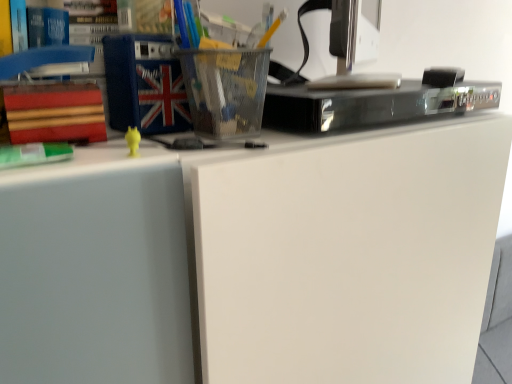
The width and height of the screenshot is (512, 384). What are the coordinates of `black glossy dvd player at upper center` in the screenshot? It's located at 370,105.

Considering the sizes of objects black glossy dvd player at upper center and blue fabric book at upper left, placed as the 1th paperback book when sorted from right to left, in the image provided, who is bigger, black glossy dvd player at upper center or blue fabric book at upper left, placed as the 1th paperback book when sorted from right to left,?

black glossy dvd player at upper center is bigger.

How distant is black glossy dvd player at upper center from blue fabric book at upper left, placed as the 1th paperback book when sorted from right to left?

The distance of black glossy dvd player at upper center from blue fabric book at upper left, placed as the 1th paperback book when sorted from right to left, is 9.65 inches.

From a real-world perspective, between black glossy dvd player at upper center and blue fabric book at upper left, placed as the 1th paperback book when sorted from right to left, who is vertically higher?

blue fabric book at upper left, placed as the 1th paperback book when sorted from right to left, is physically above.

Is black glossy dvd player at upper center looking in the opposite direction of blue fabric book at upper left, which is the second paperback book in bottom-to-top order?

No, black glossy dvd player at upper center is not facing the opposite direction of blue fabric book at upper left, which is the second paperback book in bottom-to-top order.

Which of these two, black glossy dvd player at upper center or metallic silver desktop computer at upper right, is thinner?

With smaller width is metallic silver desktop computer at upper right.

From a real-world perspective, who is located higher, black glossy dvd player at upper center or metallic silver desktop computer at upper right?

metallic silver desktop computer at upper right, from a real-world perspective.

Can metallic silver desktop computer at upper right be found inside black glossy dvd player at upper center?

No.

From the picture: Can you confirm if black glossy dvd player at upper center is shorter than metallic silver desktop computer at upper right?

Correct, black glossy dvd player at upper center is not as tall as metallic silver desktop computer at upper right.

What's the angular difference between blue fabric book at upper left, placed as the 1th paperback book when sorted from right to left, and green matte book at left's facing directions?

0.629 degrees.

Between blue fabric book at upper left, acting as the first paperback book starting from the top, and green matte book at left, which one has larger size?

Bigger between the two is blue fabric book at upper left, acting as the first paperback book starting from the top.

Considering the relative sizes of blue fabric book at upper left, placed as the 1th paperback book when sorted from right to left, and green matte book at left in the image provided, is blue fabric book at upper left, placed as the 1th paperback book when sorted from right to left, thinner than green matte book at left?

No, blue fabric book at upper left, placed as the 1th paperback book when sorted from right to left, is not thinner than green matte book at left.

Relative to green matte book at left, is blue fabric book at upper left, the 2th paperback book when ordered from left to right, in front or behind?

Clearly, blue fabric book at upper left, the 2th paperback book when ordered from left to right, is behind green matte book at left.

Which object is positioned more to the left, red matte book at left, positioned as the 2th paperback book in top-to-bottom order, or black glossy dvd player at upper center?

From the viewer's perspective, red matte book at left, positioned as the 2th paperback book in top-to-bottom order, appears more on the left side.

Consider the image. Considering the relative sizes of red matte book at left, positioned as the 2th paperback book in top-to-bottom order, and black glossy dvd player at upper center in the image provided, is red matte book at left, positioned as the 2th paperback book in top-to-bottom order, shorter than black glossy dvd player at upper center?

Incorrect, the height of red matte book at left, positioned as the 2th paperback book in top-to-bottom order, does not fall short of that of black glossy dvd player at upper center.

Between red matte book at left, placed as the second paperback book when sorted from right to left, and black glossy dvd player at upper center, which one has larger size?

Bigger between the two is black glossy dvd player at upper center.

Is green matte book at left closer to camera compared to metallic silver desktop computer at upper right?

Yes, green matte book at left is closer to the viewer.

Between point (24, 147) and point (376, 26), which one is positioned behind?

Positioned behind is point (376, 26).

Is green matte book at left wider than metallic silver desktop computer at upper right?

In fact, green matte book at left might be narrower than metallic silver desktop computer at upper right.

From a real-world perspective, is red matte book at left, the first paperback book when ordered from left to right, on top of metallic silver desktop computer at upper right?

Actually, red matte book at left, the first paperback book when ordered from left to right, is physically below metallic silver desktop computer at upper right in the real world.

Is point (98, 120) closer or farther from the camera than point (343, 5)?

Point (98, 120) is closer to the camera than point (343, 5).

Looking at this image, is red matte book at left, positioned as the 2th paperback book in top-to-bottom order, inside the boundaries of metallic silver desktop computer at upper right, or outside?

red matte book at left, positioned as the 2th paperback book in top-to-bottom order, is located beyond the bounds of metallic silver desktop computer at upper right.

Is blue fabric book at upper left, acting as the first paperback book starting from the top, facing away from metallic silver desktop computer at upper right?

That's not correct — blue fabric book at upper left, acting as the first paperback book starting from the top, is not looking away from metallic silver desktop computer at upper right.

Where is `paperback book that is above the metallic silver desktop computer at upper right (from the image's perspective)`? The height and width of the screenshot is (384, 512). paperback book that is above the metallic silver desktop computer at upper right (from the image's perspective) is located at coordinates (144, 84).

Can you tell me how much blue fabric book at upper left, placed as the 1th paperback book when sorted from right to left, and metallic silver desktop computer at upper right differ in facing direction?

41.3 degrees.

At what (x,y) coordinates should I click in order to perform the action: click on paperback book above the black glossy dvd player at upper center (from the image's perspective). Please return your answer as a coordinate pair (x, y). The width and height of the screenshot is (512, 384). Looking at the image, I should click on (144, 84).

The width and height of the screenshot is (512, 384). I want to click on desktop computer on the right of black glossy dvd player at upper center, so click(x=353, y=49).

From the image, which object appears to be nearer to green matte book at left, blue fabric book at upper left, which is the second paperback book in bottom-to-top order, or black glossy dvd player at upper center?

blue fabric book at upper left, which is the second paperback book in bottom-to-top order.

Considering their positions, is green matte book at left positioned closer to blue fabric book at upper left, which is the second paperback book in bottom-to-top order, than red matte book at left, positioned as the 2th paperback book in top-to-bottom order?

Based on the image, red matte book at left, positioned as the 2th paperback book in top-to-bottom order, appears to be nearer to blue fabric book at upper left, which is the second paperback book in bottom-to-top order.

From the image, which object appears to be farther from red matte book at left, the first paperback book when ordered from left to right, metallic silver desktop computer at upper right or blue fabric book at upper left, which is the second paperback book in bottom-to-top order?

The object further to red matte book at left, the first paperback book when ordered from left to right, is metallic silver desktop computer at upper right.

Considering their positions, is metallic silver desktop computer at upper right positioned closer to green matte book at left than blue fabric book at upper left, the 2th paperback book when ordered from left to right?

Among the two, blue fabric book at upper left, the 2th paperback book when ordered from left to right, is located nearer to green matte book at left.

Looking at the image, which one is located closer to black glossy dvd player at upper center, red matte book at left, the first paperback book when ordered from left to right, or metallic silver desktop computer at upper right?

Among the two, metallic silver desktop computer at upper right is located nearer to black glossy dvd player at upper center.

Based on their spatial positions, is black glossy dvd player at upper center or red matte book at left, the first paperback book when ordered from left to right, further from green matte book at left?

black glossy dvd player at upper center.

From the image, which object appears to be farther from blue fabric book at upper left, acting as the first paperback book starting from the top, green matte book at left or metallic silver desktop computer at upper right?

metallic silver desktop computer at upper right.

Consider the image. Estimate the real-world distances between objects in this image. Which object is closer to blue fabric book at upper left, acting as the first paperback book starting from the top, black glossy dvd player at upper center or red matte book at left, placed as the second paperback book when sorted from right to left?

Based on the image, red matte book at left, placed as the second paperback book when sorted from right to left, appears to be nearer to blue fabric book at upper left, acting as the first paperback book starting from the top.

I want to click on paperback book between red matte book at left, positioned as the 1th paperback book in bottom-to-top order, and black glossy dvd player at upper center from left to right, so click(x=144, y=84).

Where is `appliance located between red matte book at left, positioned as the 2th paperback book in top-to-bottom order, and metallic silver desktop computer at upper right in the left-right direction`? appliance located between red matte book at left, positioned as the 2th paperback book in top-to-bottom order, and metallic silver desktop computer at upper right in the left-right direction is located at coordinates (370, 105).

Identify the location of paperback book between red matte book at left, the first paperback book when ordered from left to right, and metallic silver desktop computer at upper right, in the horizontal direction. (144, 84).

Find the location of a particular element. appliance between green matte book at left and metallic silver desktop computer at upper right is located at coordinates (370, 105).